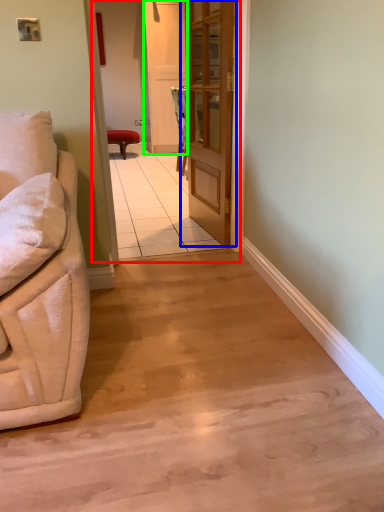
Question: Estimate the real-world distances between objects in this image. Which object is closer to corridor (highlighted by a red box), door (highlighted by a blue box) or screen door (highlighted by a green box)?

Choices:
 (A) door
 (B) screen door

Answer: (B)